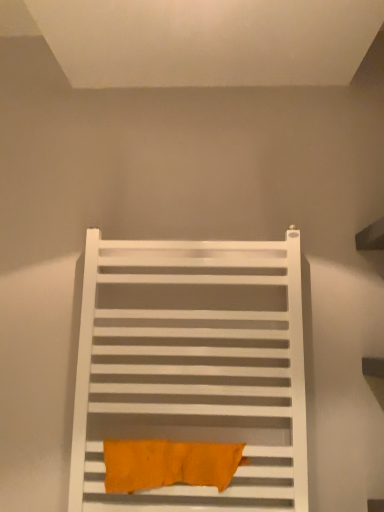
Describe the element at coordinates (168, 464) in the screenshot. I see `orange fabric towel at center` at that location.

Find the location of a particular element. orange fabric towel at center is located at coordinates (168, 464).

Measure the distance between orange fabric towel at center and camera.

The distance of orange fabric towel at center from camera is 34.76 inches.

This screenshot has height=512, width=384. Identify the location of white matte towel rack at center. (193, 366).

Measure the distance between point (x=79, y=499) and camera.

The depth of point (x=79, y=499) is 34.92 inches.

Describe the element at coordinates (193, 366) in the screenshot. I see `white matte towel rack at center` at that location.

Identify the location of orange fabric towel at center. (168, 464).

Does orange fabric towel at center appear on the right side of white matte towel rack at center?

Indeed, orange fabric towel at center is positioned on the right side of white matte towel rack at center.

Between orange fabric towel at center and white matte towel rack at center, which one is positioned in front?

white matte towel rack at center is more forward.

Considering the points (218, 461) and (195, 292), which point is in front, point (218, 461) or point (195, 292)?

Point (218, 461)

From the image's perspective, between orange fabric towel at center and white matte towel rack at center, which one is located above?

white matte towel rack at center appears higher in the image.

From a real-world perspective, does orange fabric towel at center stand above white matte towel rack at center?

No, from a real-world perspective, orange fabric towel at center is not over white matte towel rack at center

Can you confirm if orange fabric towel at center is thinner than white matte towel rack at center?

Yes, orange fabric towel at center is thinner than white matte towel rack at center.

Considering the relative sizes of orange fabric towel at center and white matte towel rack at center in the image provided, is orange fabric towel at center taller than white matte towel rack at center?

No.

Who is bigger, orange fabric towel at center or white matte towel rack at center?

white matte towel rack at center is bigger.

Can we say orange fabric towel at center lies outside white matte towel rack at center?

That's incorrect, orange fabric towel at center is not completely outside white matte towel rack at center.

Is orange fabric towel at center in contact with white matte towel rack at center?

No, orange fabric towel at center is not in contact with white matte towel rack at center.

Is white matte towel rack at center at the back of orange fabric towel at center?

Yes, orange fabric towel at center's orientation is away from white matte towel rack at center.

Where is `furniture on the left of orange fabric towel at center`? The image size is (384, 512). furniture on the left of orange fabric towel at center is located at coordinates (193, 366).

Does white matte towel rack at center appear on the right side of orange fabric towel at center?

No.

Is white matte towel rack at center positioned before orange fabric towel at center?

Yes, white matte towel rack at center is in front of orange fabric towel at center.

Considering the positions of points (295, 246) and (105, 444), is point (295, 246) farther from camera compared to point (105, 444)?

That is True.

From the image's perspective, is white matte towel rack at center located above or below orange fabric towel at center?

white matte towel rack at center is situated higher than orange fabric towel at center in the image.

From a real-world perspective, who is located higher, white matte towel rack at center or orange fabric towel at center?

From a 3D spatial view, white matte towel rack at center is above.

Considering the relative sizes of white matte towel rack at center and orange fabric towel at center in the image provided, is white matte towel rack at center thinner than orange fabric towel at center?

No.

Consider the image. Is white matte towel rack at center taller or shorter than orange fabric towel at center?

white matte towel rack at center is taller than orange fabric towel at center.

In terms of size, does white matte towel rack at center appear bigger or smaller than orange fabric towel at center?

white matte towel rack at center is bigger than orange fabric towel at center.

Would you say white matte towel rack at center is outside orange fabric towel at center?

white matte towel rack at center is positioned outside orange fabric towel at center.

Is white matte towel rack at center not near orange fabric towel at center?

No, there isn't a large distance between white matte towel rack at center and orange fabric towel at center.

Looking at this image, is white matte towel rack at center looking in the opposite direction of orange fabric towel at center?

Yes, white matte towel rack at center's orientation is away from orange fabric towel at center.

Can you tell me how much white matte towel rack at center and orange fabric towel at center differ in facing direction?

The angular difference between white matte towel rack at center and orange fabric towel at center is 0.000269 degrees.

Where is `bath towel behind the white matte towel rack at center`? bath towel behind the white matte towel rack at center is located at coordinates (168, 464).

Locate an element on the screen. This screenshot has width=384, height=512. bath towel on the right of white matte towel rack at center is located at coordinates (168, 464).

Identify the location of furniture above the orange fabric towel at center (from the image's perspective). This screenshot has height=512, width=384. (193, 366).